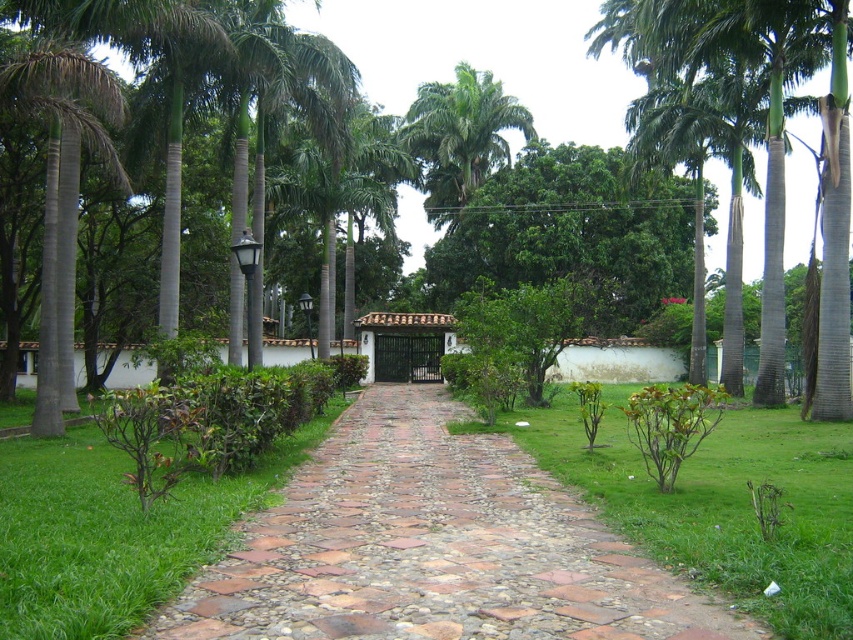
Can you confirm if green grass at center is positioned to the right of green leafy palm tree at left?

Indeed, green grass at center is positioned on the right side of green leafy palm tree at left.

Does green grass at center have a lesser width compared to green leafy palm tree at left?

In fact, green grass at center might be wider than green leafy palm tree at left.

Who is more distant from viewer, (x=628, y=385) or (x=73, y=179)?

Positioned behind is point (x=628, y=385).

Where is `green grass at center`? The width and height of the screenshot is (853, 640). green grass at center is located at coordinates (718, 502).

Between brown cobblestone path at center and green leafy palm tree at upper center, which one is positioned higher?

green leafy palm tree at upper center is above.

Who is more forward, (328, 444) or (399, 131)?

Point (328, 444) is in front.

Does point (408, 625) come behind point (509, 96)?

No.

At what (x,y) coordinates should I click in order to perform the action: click on brown cobblestone path at center. Please return your answer as a coordinate pair (x, y). The height and width of the screenshot is (640, 853). Looking at the image, I should click on (432, 547).

Is green grass at center wider than green leafy palm tree at upper center?

Yes.

Does green grass at center have a lesser height compared to green leafy palm tree at upper center?

Yes, green grass at center is shorter than green leafy palm tree at upper center.

The width and height of the screenshot is (853, 640). In order to click on green grass at center in this screenshot , I will do pyautogui.click(x=718, y=502).